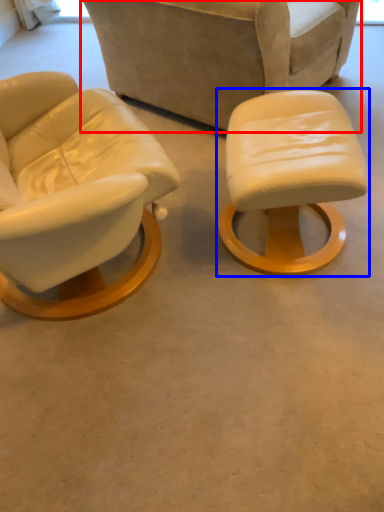
Question: Among these objects, which one is farthest to the camera, chair (highlighted by a red box) or stool (highlighted by a blue box)?

Choices:
 (A) chair
 (B) stool

Answer: (A)